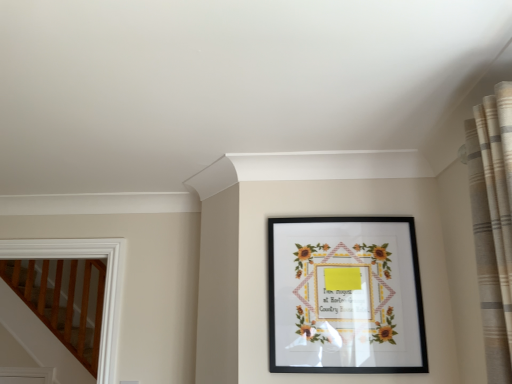
Find the location of a particular element. This screenshot has width=512, height=384. black matte picture frame at upper center is located at coordinates (345, 296).

What do you see at coordinates (345, 296) in the screenshot? I see `black matte picture frame at upper center` at bounding box center [345, 296].

Find the location of a particular element. Image resolution: width=512 pixels, height=384 pixels. black matte picture frame at upper center is located at coordinates (345, 296).